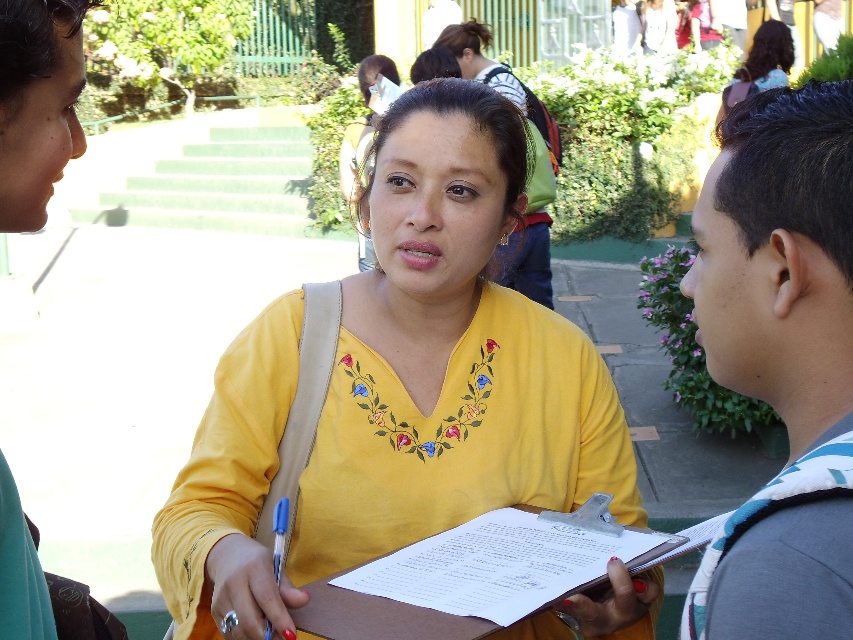
What are the coordinates of the yellow embroidered shirt at center?

The yellow embroidered shirt at center is located at point [398,387].

You are a photographer trying to capture a detailed shot of the gray fabric backpack at right and the curly hair at upper right. Which object should you zoom in on to ensure both fit in the frame without cropping?

The gray fabric backpack at right has a smaller width than the curly hair at upper right, so you should zoom in on the curly hair at upper right to ensure both fit in the frame without cropping.